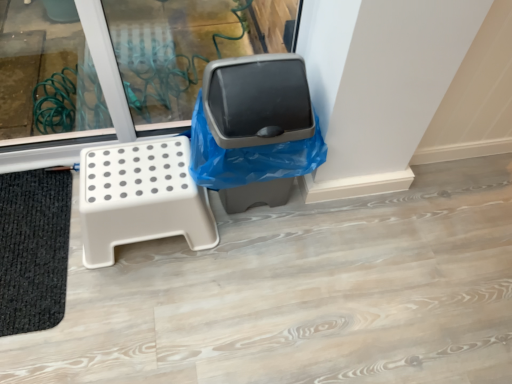
Find the location of a particular element. This screenshot has height=384, width=512. vacant space that's between matte plastic trash can at center and white plastic stool at left is located at coordinates (248, 229).